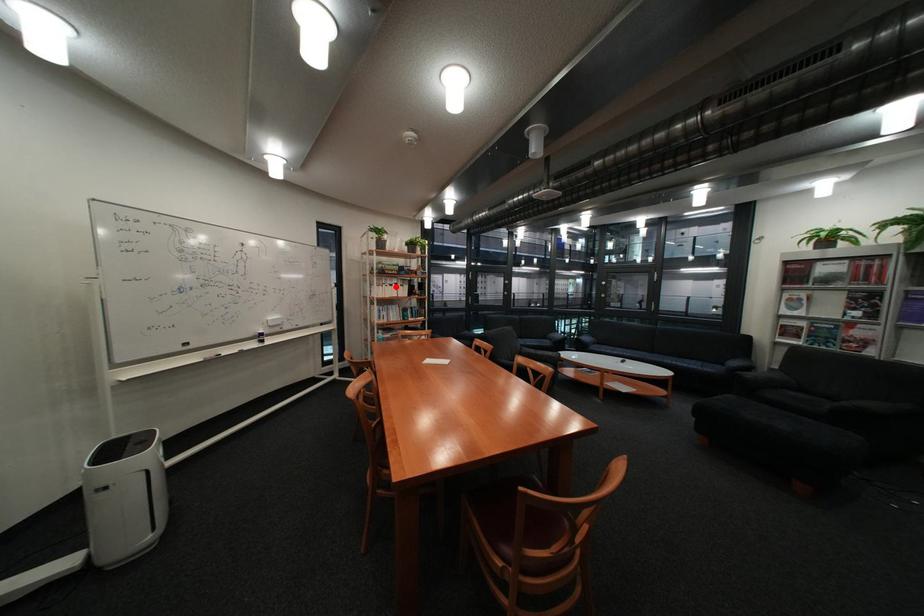
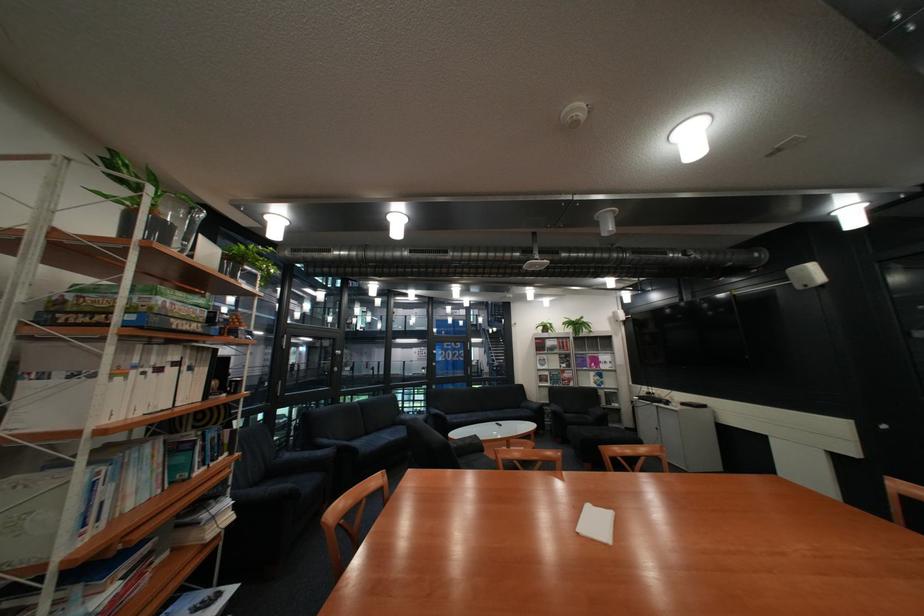
The point at the highlighted location is marked in the first image. Where is the corresponding point in the second image?

(134, 379)